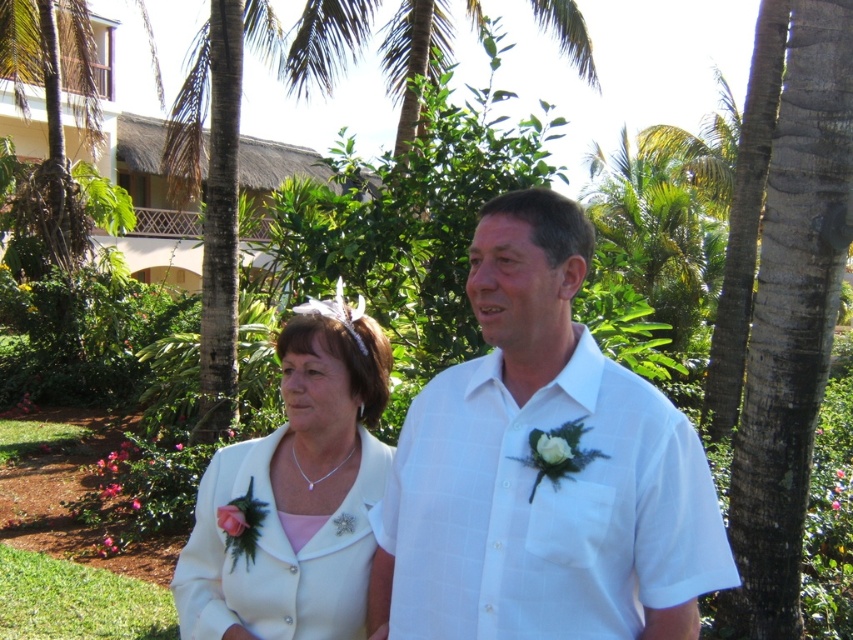
How far apart are white cotton shirt at center and white satin jacket at center?

They are 15.12 inches apart.

Who is more distant from viewer, (502, 513) or (223, 584)?

The point (223, 584) is behind.

The image size is (853, 640). In order to click on white cotton shirt at center in this screenshot , I will do `click(543, 468)`.